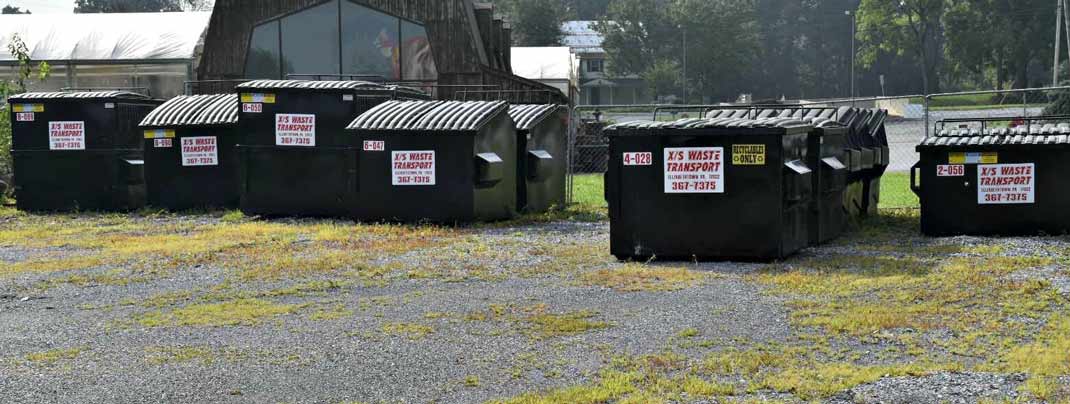
Where is `windows`? windows is located at coordinates (262, 57), (299, 47), (366, 52), (422, 56).